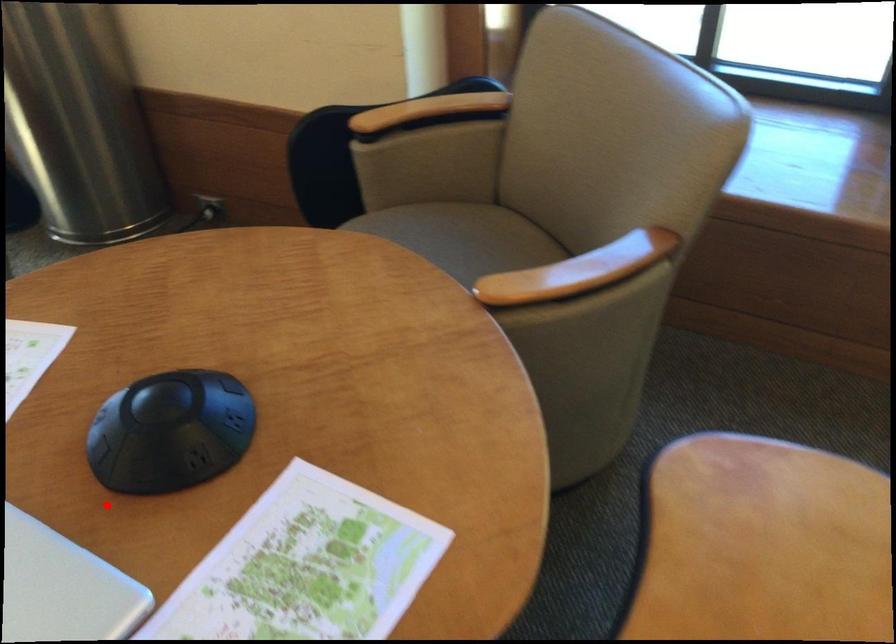
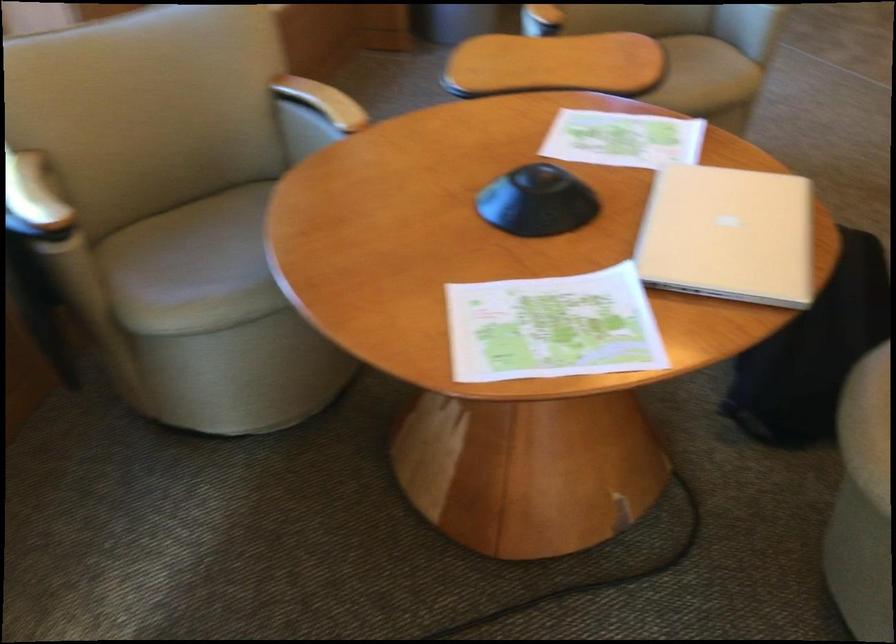
In the second image, find the point that corresponds to the highlighted location in the first image.

(537, 202)